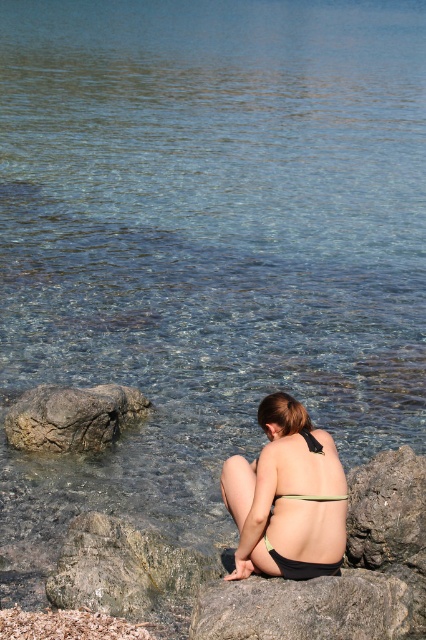
Question: Among these objects, which one is farthest from the camera?

Choices:
 (A) gray rough rock at lower center
 (B) black bikini bottom at lower center
 (C) gray rough rock at lower left

Answer: (C)

Question: Can you confirm if black bikini bottom at lower center is wider than gray rough rock at lower center?

Choices:
 (A) no
 (B) yes

Answer: (A)

Question: Which object is closer to the camera taking this photo?

Choices:
 (A) black bikini bottom at lower center
 (B) black matte bikini top at center

Answer: (A)

Question: Is the position of green mossy rock at lower left less distant than that of black matte bikini top at center?

Choices:
 (A) yes
 (B) no

Answer: (A)

Question: Which point is farther from the camera taking this photo?

Choices:
 (A) (236, 589)
 (B) (51, 593)
 (C) (281, 497)
 (D) (311, 532)

Answer: (B)

Question: Can you confirm if gray rough rock at lower center is positioned to the left of gray rough rock at lower left?

Choices:
 (A) yes
 (B) no

Answer: (B)